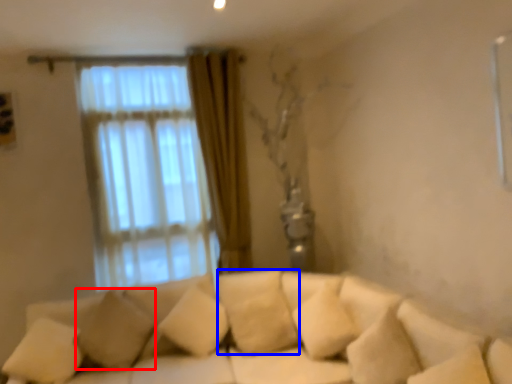
Question: Which of the following is the closest to the observer, pillow (highlighted by a red box) or pillow (highlighted by a blue box)?

Choices:
 (A) pillow
 (B) pillow

Answer: (A)